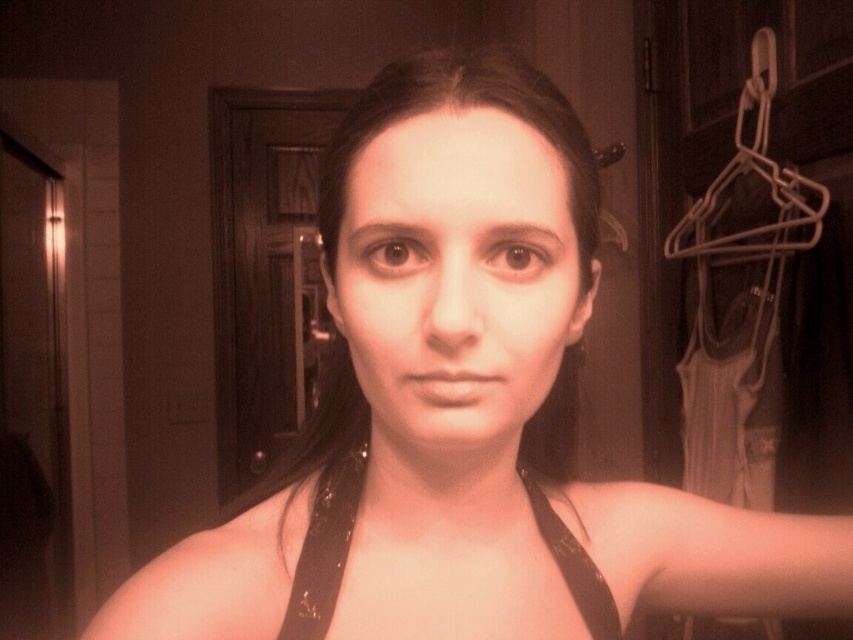
Question: Which point is closer to the camera?

Choices:
 (A) 809,216
 (B) 473,237

Answer: (B)

Question: Can you confirm if black leather strap at center is thinner than white plastic hanger at upper right?

Choices:
 (A) yes
 (B) no

Answer: (A)

Question: Which object is farther from the camera taking this photo?

Choices:
 (A) black leather strap at center
 (B) smooth skin face at center
 (C) white plastic hanger at upper right

Answer: (C)

Question: Is smooth skin face at center smaller than black leather strap at center?

Choices:
 (A) yes
 (B) no

Answer: (B)

Question: Is smooth skin face at center further to the viewer compared to white plastic hanger at upper right?

Choices:
 (A) no
 (B) yes

Answer: (A)

Question: Which point is closer to the camera taking this photo?

Choices:
 (A) (749, 76)
 (B) (386, 136)

Answer: (B)